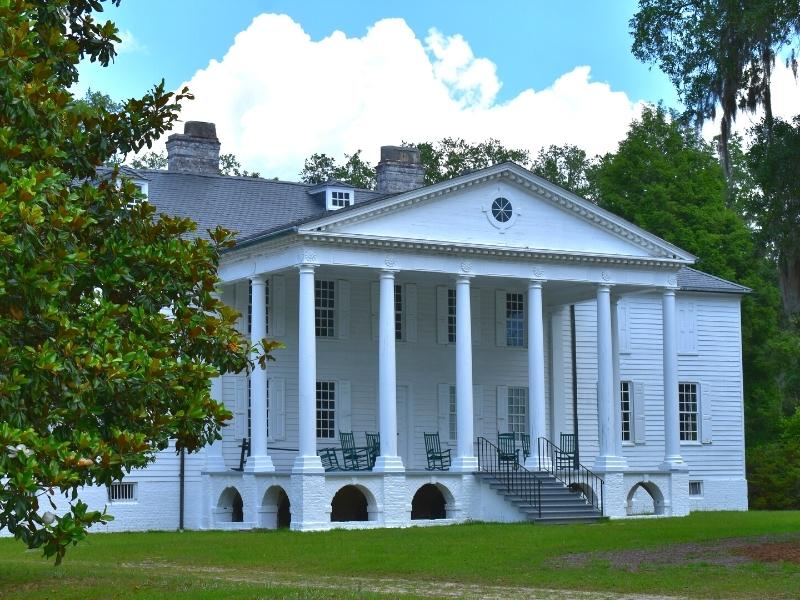
Find the location of a particular element. This screenshot has width=800, height=600. banister rails is located at coordinates pyautogui.click(x=518, y=466), pyautogui.click(x=574, y=457).